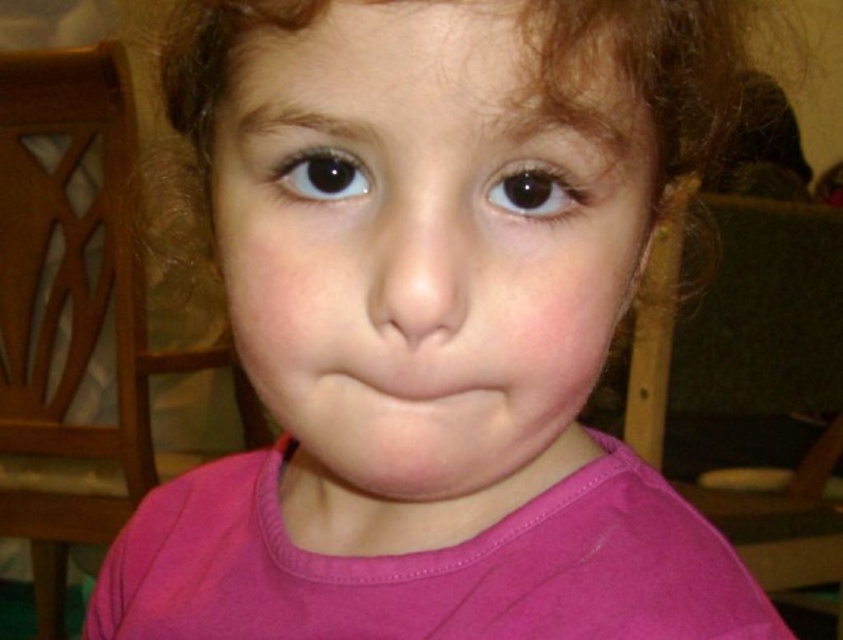
Question: Which point appears closest to the camera in this image?

Choices:
 (A) (578, 196)
 (B) (787, 68)
 (C) (347, 154)

Answer: (C)

Question: Does smooth skin face at center have a smaller size compared to black glossy eye at upper left?

Choices:
 (A) no
 (B) yes

Answer: (A)

Question: Which point is farther to the camera?

Choices:
 (A) (404, 84)
 (B) (552, 205)
 (C) (315, 182)

Answer: (C)

Question: In this image, where is brown shiny eye at center located relative to black glossy eye at upper left?

Choices:
 (A) left
 (B) right

Answer: (B)

Question: Among these points, which one is farthest from the camera?

Choices:
 (A) (556, 170)
 (B) (287, 170)
 (C) (827, 20)
 (D) (404, 433)

Answer: (C)

Question: Is smooth skin face at center to the left of brown shiny eye at center from the viewer's perspective?

Choices:
 (A) no
 (B) yes

Answer: (B)